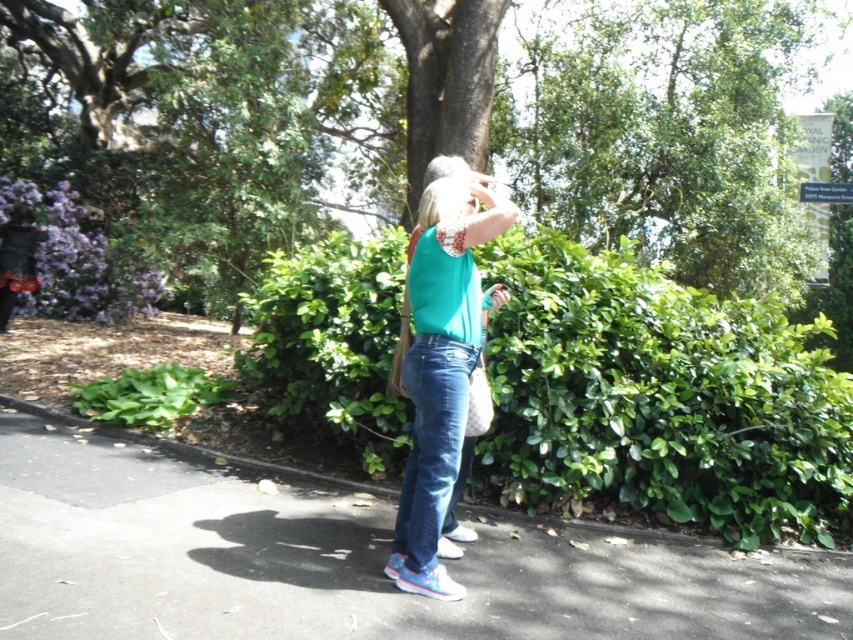
In the scene shown: You are standing at the camera position and want to reach the two points in the image. Which point should you reach first, point (518,566) or point (477,276)?

Point (518,566) is closer to you than point (477,276), so you should reach point (518,566) first.

You are a gardener who needs to trim the green leafy hedge at center. Since you are standing on the black asphalt pavement at center, can you reach the hedge easily?

The green leafy hedge at center is located above black asphalt pavement at center, so you can easily reach it while standing on the pavement.